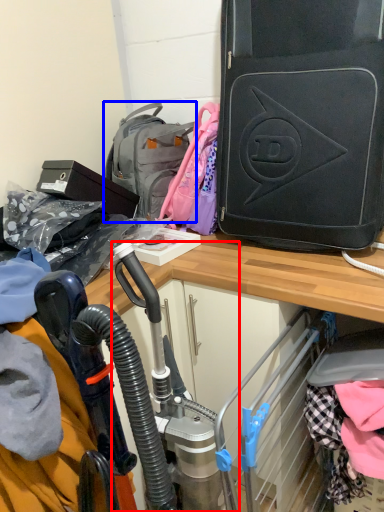
Question: Which object is closer to the camera taking this photo, sport equipment (highlighted by a red box) or backpack (highlighted by a blue box)?

Choices:
 (A) sport equipment
 (B) backpack

Answer: (A)